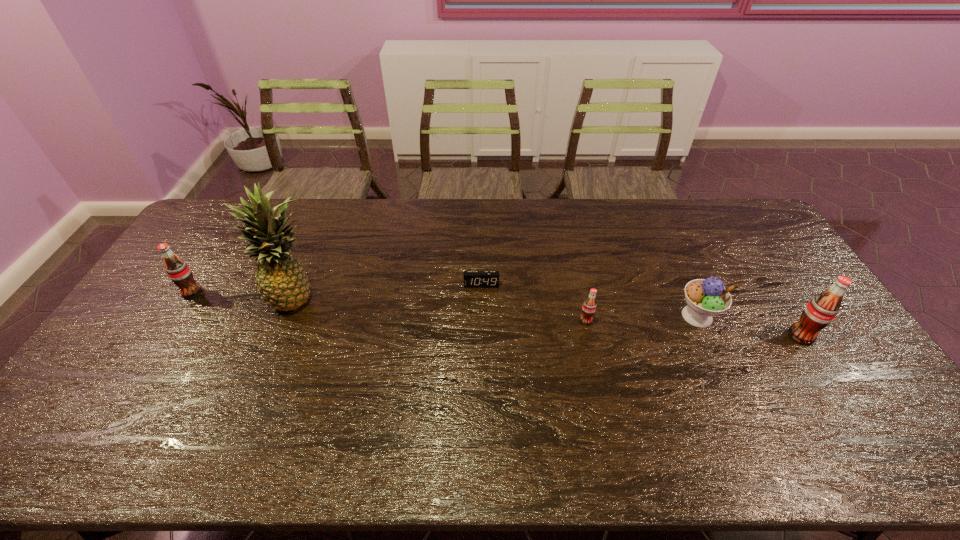
You are a GUI agent. You are given a task and a screenshot of the screen. Output one action in this format:
    pyautogui.click(x=<x>, y=<y>)
    Task: Click on the free space between the shortest object and the farthest soda
    This screenshot has height=540, width=960.
    Given the screenshot: What is the action you would take?
    coord(337,289)

The image size is (960, 540). In order to click on vacant region between the fifth tallest object and the icecream in this screenshot , I will do `click(641, 319)`.

At what (x,y) coordinates should I click in order to perform the action: click on free spot between the rightmost soda and the shortest object. Please return your answer as a coordinate pair (x, y). Looking at the image, I should click on (641, 310).

I want to click on unoccupied position between the third tallest object and the rightmost object, so click(x=496, y=314).

Locate an element on the screen. The width and height of the screenshot is (960, 540). vacant point located between the pineapple and the third shortest object is located at coordinates (497, 306).

This screenshot has height=540, width=960. What are the coordinates of `object that is the second closest to the icecream` in the screenshot? It's located at (589, 306).

Identify which object is located as the fourth nearest to the shortest object. Please provide its 2D coordinates. Your answer should be formatted as a tuple, i.e. [(x, y)], where the tuple contains the x and y coordinates of a point satisfying the conditions above.

[(178, 271)]

Point out which soda is positioned as the nearest to the second nearest soda. Please provide its 2D coordinates. Your answer should be formatted as a tuple, i.e. [(x, y)], where the tuple contains the x and y coordinates of a point satisfying the conditions above.

[(821, 310)]

Where is `soda that stands as the closest to the fourth shortest object`? soda that stands as the closest to the fourth shortest object is located at coordinates click(x=589, y=306).

At what (x,y) coordinates should I click in order to perform the action: click on vacant space that satisfies the following two spatial constraints: 1. on the front side of the nearest soda; 2. on the left side of the shortest soda. Please return your answer as a coordinate pair (x, y). This screenshot has width=960, height=540. Looking at the image, I should click on (589, 336).